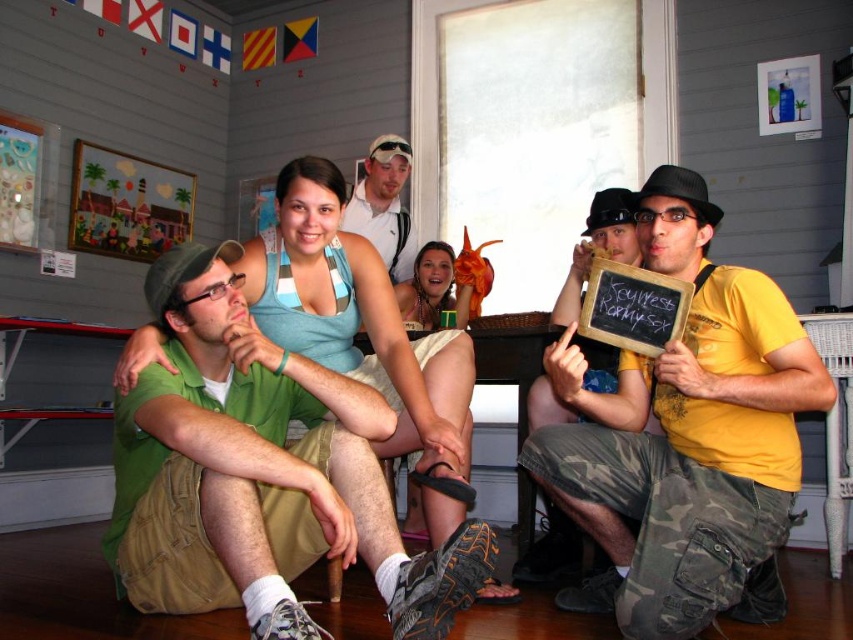
Can you confirm if camouflage pants at lower right is positioned to the left of smooth tan skin at center?

No, camouflage pants at lower right is not to the left of smooth tan skin at center.

Does camouflage pants at lower right have a smaller size compared to smooth tan skin at center?

No, camouflage pants at lower right is not smaller than smooth tan skin at center.

The image size is (853, 640). In order to click on camouflage pants at lower right in this screenshot , I will do `click(598, 246)`.

Is green cotton shirt at center to the left of smooth tan skin at center from the viewer's perspective?

Correct, you'll find green cotton shirt at center to the left of smooth tan skin at center.

Who is more forward, (183, 401) or (469, 291)?

Positioned in front is point (183, 401).

The image size is (853, 640). Describe the element at coordinates (271, 474) in the screenshot. I see `green cotton shirt at center` at that location.

You are a GUI agent. You are given a task and a screenshot of the screen. Output one action in this format:
    pyautogui.click(x=<x>, y=<y>)
    Task: Click on the green cotton shirt at center
    Image resolution: width=853 pixels, height=640 pixels.
    Given the screenshot: What is the action you would take?
    pyautogui.click(x=271, y=474)

Does black chalkboard at center appear under smooth tan skin at center?

Correct, black chalkboard at center is located below smooth tan skin at center.

Is black chalkboard at center taller than smooth tan skin at center?

Incorrect, black chalkboard at center's height is not larger of smooth tan skin at center's.

Identify the location of black chalkboard at center. (631, 307).

Find the location of a particular element. The width and height of the screenshot is (853, 640). black chalkboard at center is located at coordinates (631, 307).